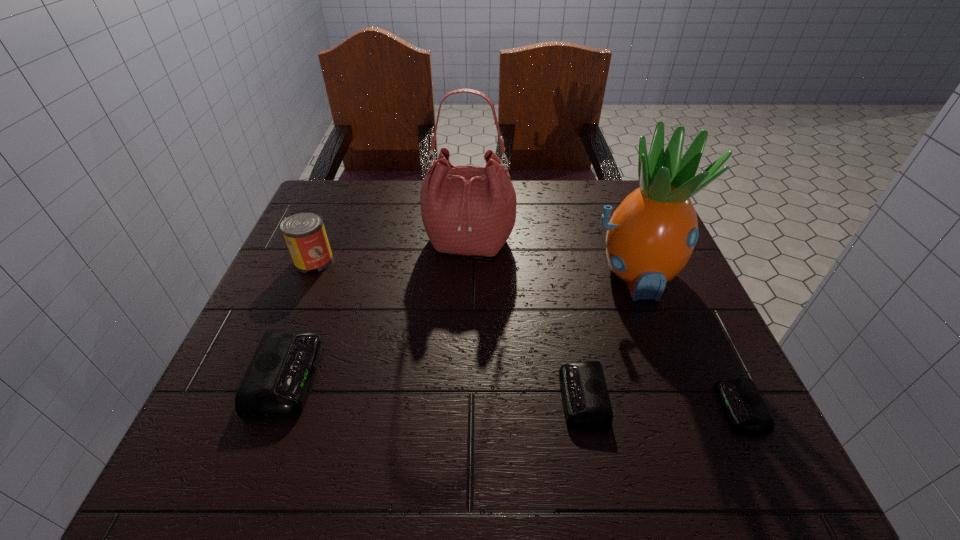
You are a GUI agent. You are given a task and a screenshot of the screen. Output one action in this format:
    pyautogui.click(x=<x>, y=<y>)
    Task: Click on the leftmost alarm clock
    This screenshot has width=960, height=540.
    Given the screenshot: What is the action you would take?
    pyautogui.click(x=276, y=384)

Identify the location of the tallest alarm clock. Image resolution: width=960 pixels, height=540 pixels. (276, 384).

The height and width of the screenshot is (540, 960). What are the coordinates of `the second alarm clock from right to left` in the screenshot? It's located at (586, 401).

Locate an element on the screen. The width and height of the screenshot is (960, 540). the second shortest object is located at coordinates (586, 401).

What are the coordinates of `the shortest alarm clock` in the screenshot? It's located at (742, 402).

Locate an element on the screen. The width and height of the screenshot is (960, 540). the shortest object is located at coordinates (742, 402).

Find the location of `the fourth object from right to left`. the fourth object from right to left is located at coordinates (467, 210).

You are a GUI agent. You are given a task and a screenshot of the screen. Output one action in this format:
    pyautogui.click(x=<x>, y=<y>)
    Task: Click on the pineapple
    
    Given the screenshot: What is the action you would take?
    pyautogui.click(x=650, y=237)

This screenshot has height=540, width=960. What are the coordinates of `can` in the screenshot? It's located at (304, 232).

The width and height of the screenshot is (960, 540). In order to click on free space located on the display of the tallest alarm clock in this screenshot , I will do `click(360, 376)`.